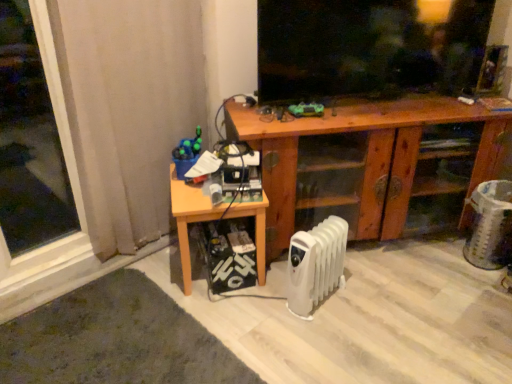
Locate an element on the screen. This screenshot has width=512, height=384. vacant point above wooden cabinet at center (from a real-world perspective) is located at coordinates (392, 106).